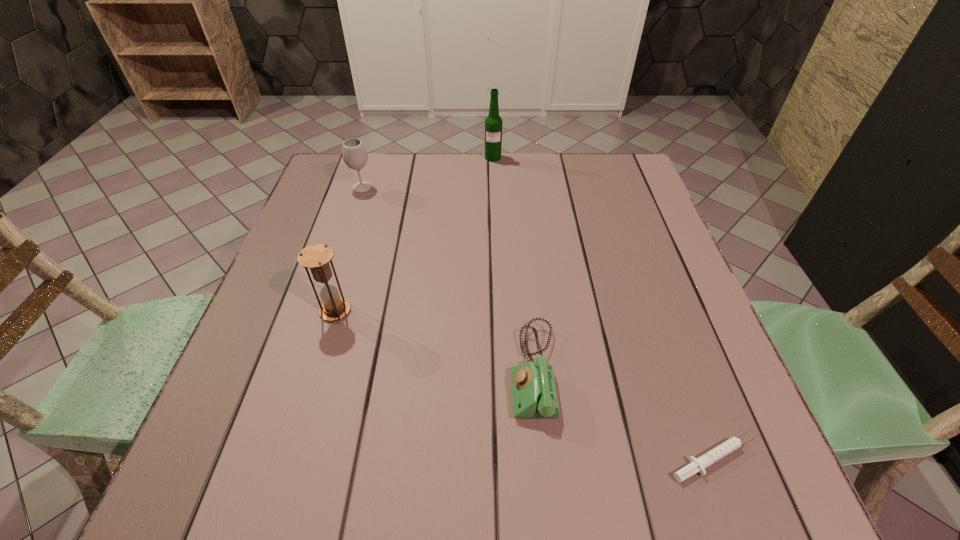
This screenshot has width=960, height=540. I want to click on free location located 0.250m on the label of the tallest object, so pyautogui.click(x=495, y=214).

Locate an element on the screen. vacant space situated 0.170m on the right of the hourglass is located at coordinates (433, 310).

This screenshot has width=960, height=540. Identify the location of vacant space located on the front of the fourth nearest object. (352, 217).

The height and width of the screenshot is (540, 960). Find the location of `vacant point located on the dial of the second nearest object`. vacant point located on the dial of the second nearest object is located at coordinates (435, 371).

The image size is (960, 540). I want to click on vacant space located on the dial of the second nearest object, so click(312, 371).

Where is `blank space located 0.050m on the dial of the second nearest object`? blank space located 0.050m on the dial of the second nearest object is located at coordinates (x=484, y=371).

Image resolution: width=960 pixels, height=540 pixels. In order to click on vacant space located on the back of the syringe in this screenshot , I will do `click(691, 389)`.

Where is `beer bottle situated at the far edge`? This screenshot has width=960, height=540. beer bottle situated at the far edge is located at coordinates (493, 123).

Locate an element on the screen. This screenshot has height=540, width=960. wineglass positioned at the far edge is located at coordinates (355, 156).

Find the location of `object situated at the near edge`. object situated at the near edge is located at coordinates (698, 465).